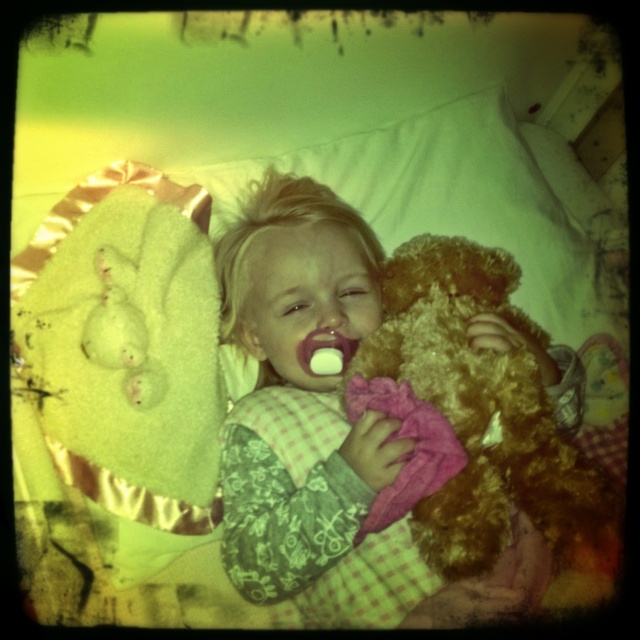
Does fluffy brown teddy bear at center appear on the left side of white plush bear at upper left?

No, fluffy brown teddy bear at center is not to the left of white plush bear at upper left.

Does point (234, 522) come in front of point (128, 284)?

Yes.

Who is more distant from viewer, (308, 618) or (148, 396)?

The point (148, 396) is behind.

I want to click on fluffy brown teddy bear at center, so click(x=326, y=433).

Locate an element on the screen. Image resolution: width=640 pixels, height=640 pixels. fluffy brown teddy bear at center is located at coordinates (326, 433).

Which of these two, fluffy brown teddy bear at center or white matte pacifier at center, stands shorter?

With less height is white matte pacifier at center.

In order to click on fluffy brown teddy bear at center in this screenshot , I will do `click(326, 433)`.

Who is shorter, fuzzy brown teddy bear at center or white plush bear at upper left?

white plush bear at upper left

Does point (536, 502) come farther from viewer compared to point (152, 394)?

No, it is not.

Who is more forward, (483, 497) or (148, 406)?

Point (483, 497) is more forward.

At what (x,y) coordinates should I click in order to perform the action: click on fuzzy brown teddy bear at center. Please return your answer as a coordinate pair (x, y). Looking at the image, I should click on (468, 417).